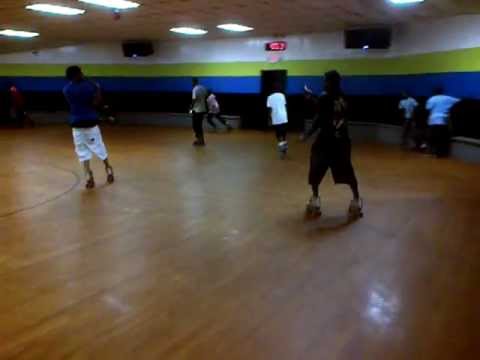
Where is `light`? The image size is (480, 360). light is located at coordinates (231, 27).